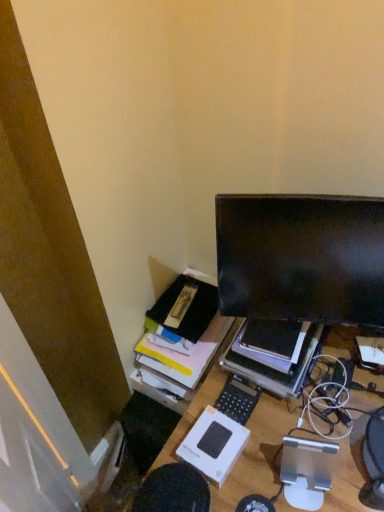
Where is `vacant point above wooden desk at center (from a real-world perspective)`? vacant point above wooden desk at center (from a real-world perspective) is located at coordinates 331,425.